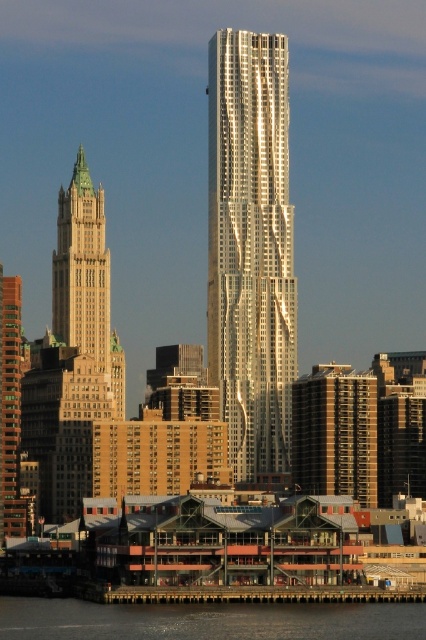
You are a tourist standing in the waterfront area and want to take a photo of both the shiny metallic skyscraper at center and the brown brick building at left. Which building should you move closer to in order to capture both in the same frame?

You should move closer to the shiny metallic skyscraper at center because it is closer to you than the brown brick building at left, allowing both to be in the same frame when positioned appropriately.

You are standing at the center of the image and want to walk to the transparent water at lower center. According to the coordinates provided, in which direction should you move?

The transparent water at lower center is located at coordinates point (207, 620). Since the y coordinate is 0.488, which is closer to 0.5, you should move downward to reach it.